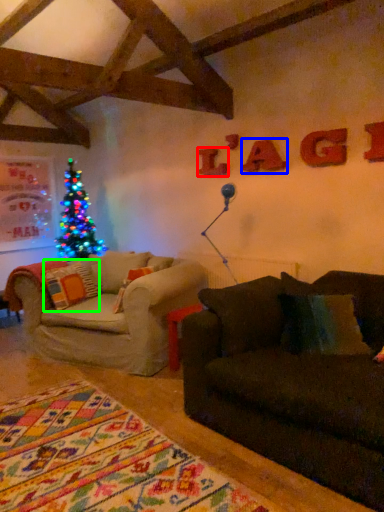
Question: Which object is the farthest from letter (highlighted by a red box)? Choose among these: letter (highlighted by a blue box) or pillow (highlighted by a green box).

Choices:
 (A) letter
 (B) pillow

Answer: (B)